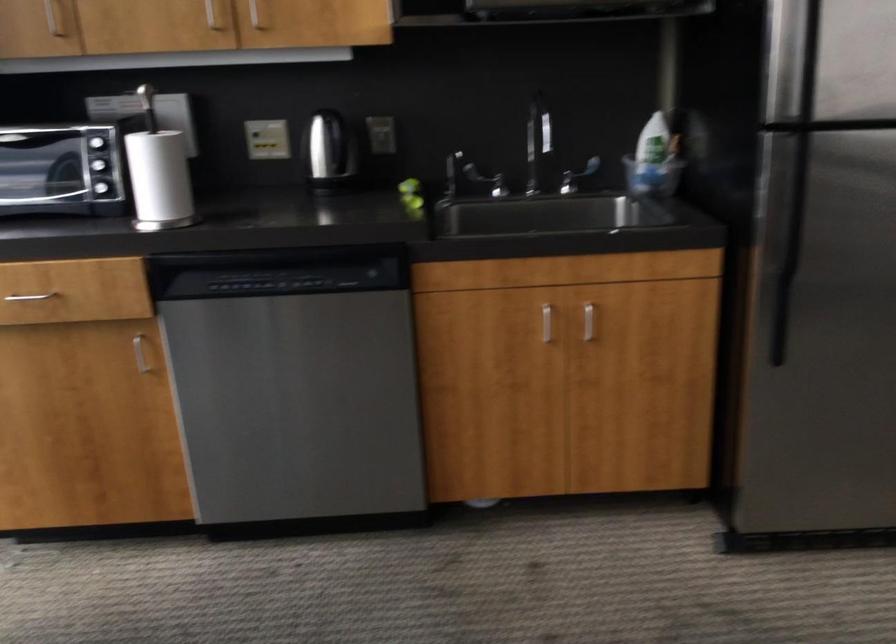
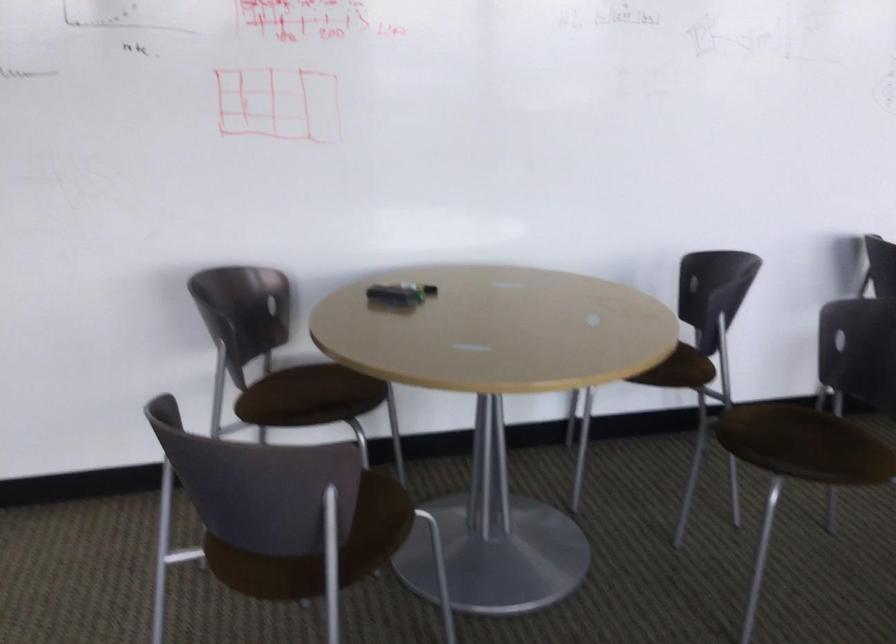
First-person continuous shooting, in which direction is the camera rotating?

The camera's rotation is toward right-down.